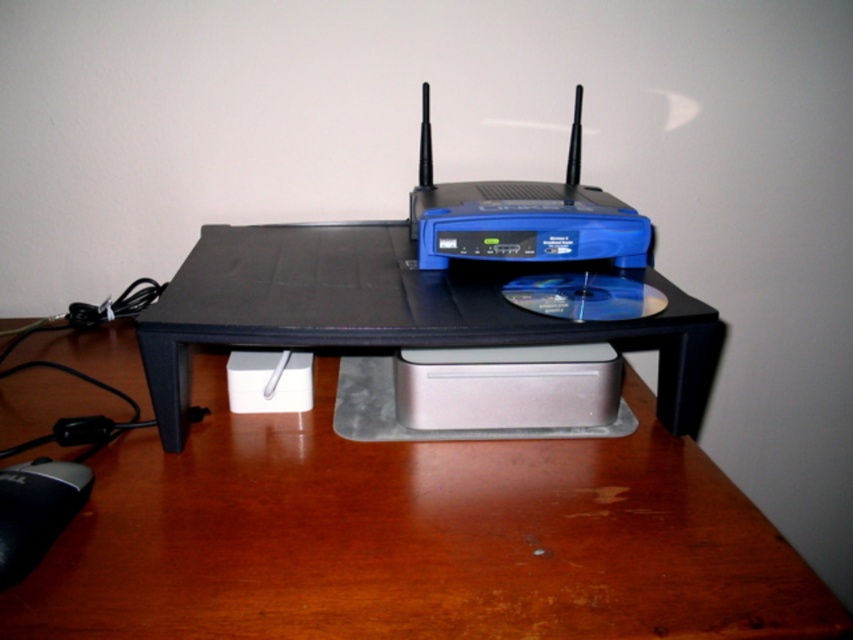
You are a photographer taking a closeup shot of the router setup on the desk. You notice two points marked in the image. Which point is closer to your camera lens, point 1 at coordinates (107, 330) or point 2 at coordinates (16, 474)?

Point 2 at coordinates (16, 474) is closer to the camera lens because the description states that point (107, 330) is further away than point (16, 474).

You are setting up a new router and need to place a 8.5 inch long cable between the black plastic table at center and the black rubber mouse at lower left. Will the cable reach without needing to move either object?

The distance between the black plastic table at center and the black rubber mouse at lower left is 7.93 inches. Since the cable is 8.5 inches long, which is longer than the distance, the cable will reach without needing to move either object.

You are setting up a new router on the desk and need to place the black rubber mouse at lower left next to the black plastic table at center. Will the mouse fit on the table if the table is wider than the mouse?

The black plastic table at center might be wider than black rubber mouse at lower left, so there is a possibility that the mouse will fit on the table. However, the exact dimensions are uncertain based on the provided information.